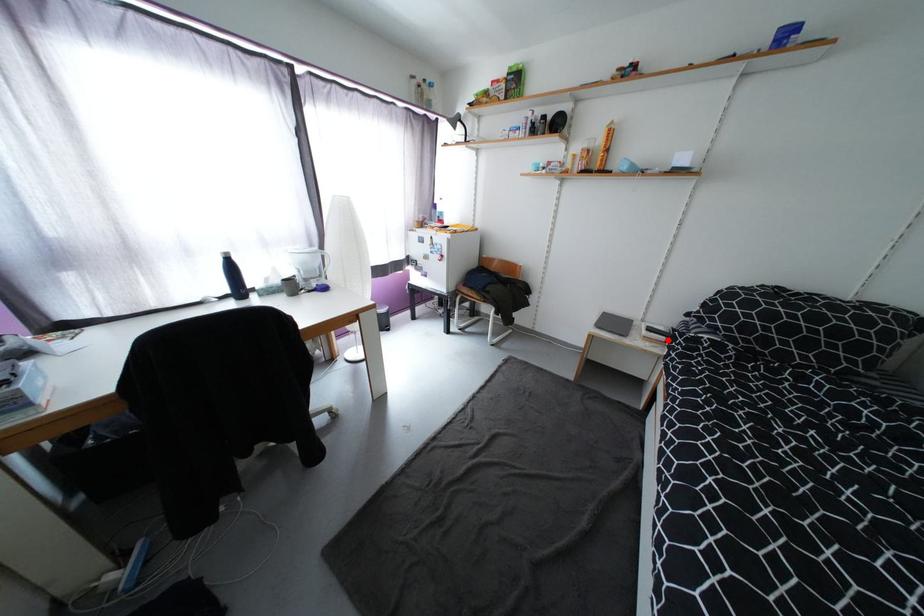
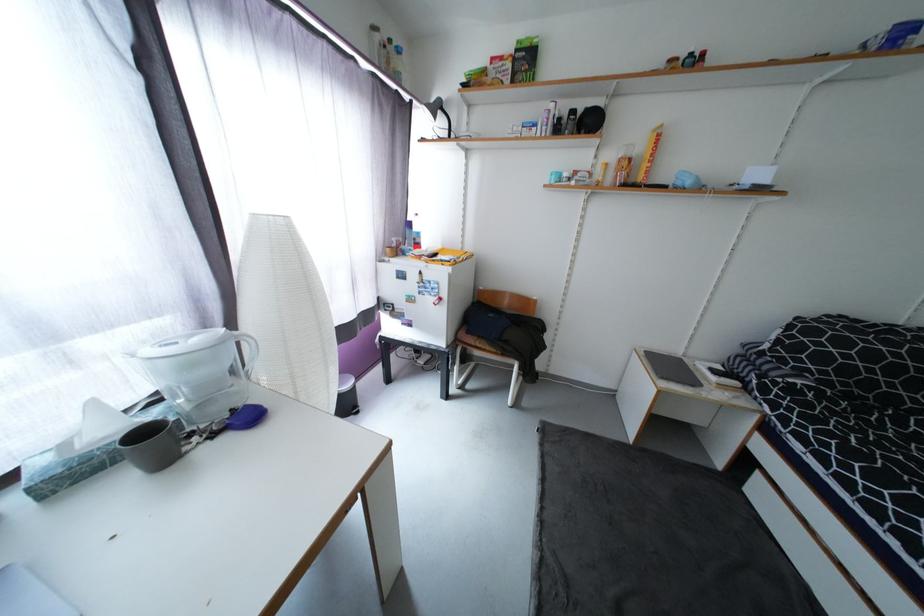
Find the pixel in the second image that matches the highlighted location in the first image.

(740, 385)